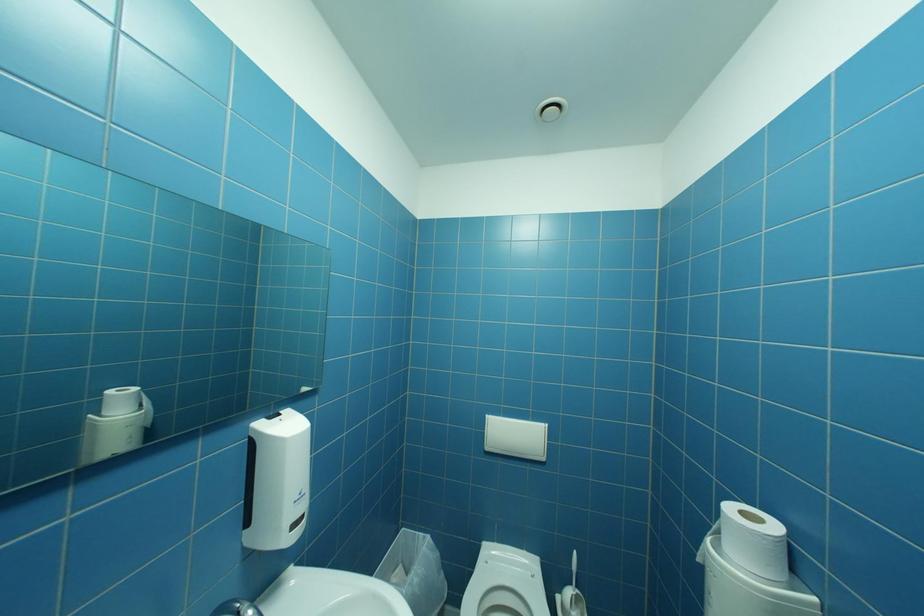
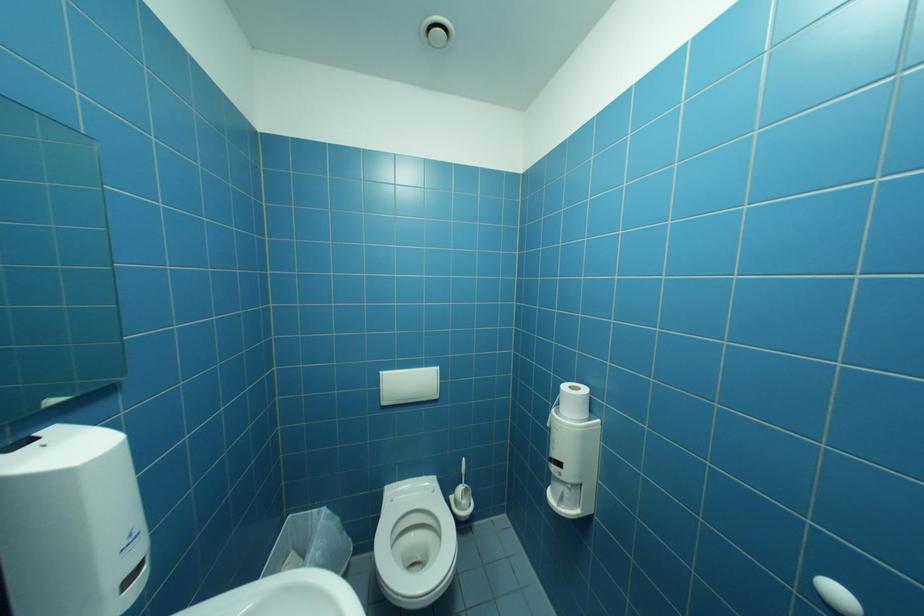
Question: The first image is from the beginning of the video and the second image is from the end. How did the camera likely rotate when shooting the video?

Choices:
 (A) Left
 (B) Right
 (C) Up
 (D) Down

Answer: (B)